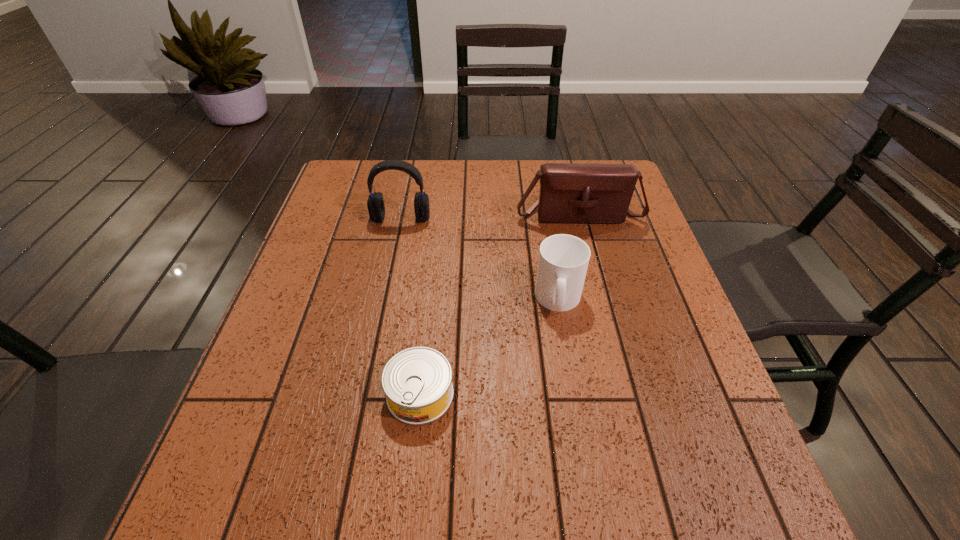
You are a GUI agent. You are given a task and a screenshot of the screen. Output one action in this format:
    pyautogui.click(x=<x>, y=<y>)
    Task: Click on the free space that satisfies the following two spatial constraints: 1. on the headband of the headset; 2. on the left side of the shortest object
    
    Given the screenshot: What is the action you would take?
    pyautogui.click(x=365, y=394)

You are a GUI agent. You are given a task and a screenshot of the screen. Output one action in this format:
    pyautogui.click(x=<x>, y=<y>)
    Task: Click on the vacant space that satisfies the following two spatial constraints: 1. on the headband of the can; 2. on the left side of the headset
    This screenshot has width=960, height=540.
    Given the screenshot: What is the action you would take?
    pyautogui.click(x=365, y=394)